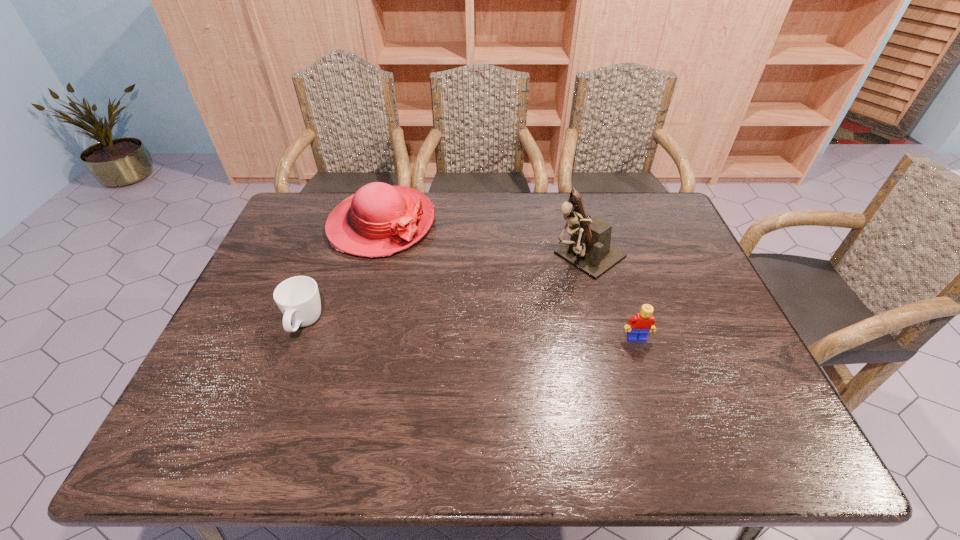
The height and width of the screenshot is (540, 960). I want to click on cup, so click(x=298, y=298).

Locate an element on the screen. Image resolution: width=960 pixels, height=540 pixels. Lego is located at coordinates (638, 326).

This screenshot has height=540, width=960. I want to click on figurine, so click(589, 250).

Locate an element on the screen. The width and height of the screenshot is (960, 540). the second tallest object is located at coordinates (379, 220).

Image resolution: width=960 pixels, height=540 pixels. I want to click on vacant space situated with the handle on the side of the cup, so click(284, 379).

Find the location of a particular element. This screenshot has width=960, height=540. blank space located 0.070m on the face of the Lego is located at coordinates (645, 367).

In order to click on vacant space situated on the front-facing side of the tallest object in this screenshot , I will do point(529,294).

Where is `free region located 0.120m on the front-facing side of the tallest object`? The width and height of the screenshot is (960, 540). free region located 0.120m on the front-facing side of the tallest object is located at coordinates (531, 293).

What are the coordinates of `vacant point located 0.100m on the front-facing side of the tallest object` in the screenshot? It's located at click(536, 289).

Find the location of a particular element. vacant space situated 0.330m at the front of the hat with a bow is located at coordinates (469, 321).